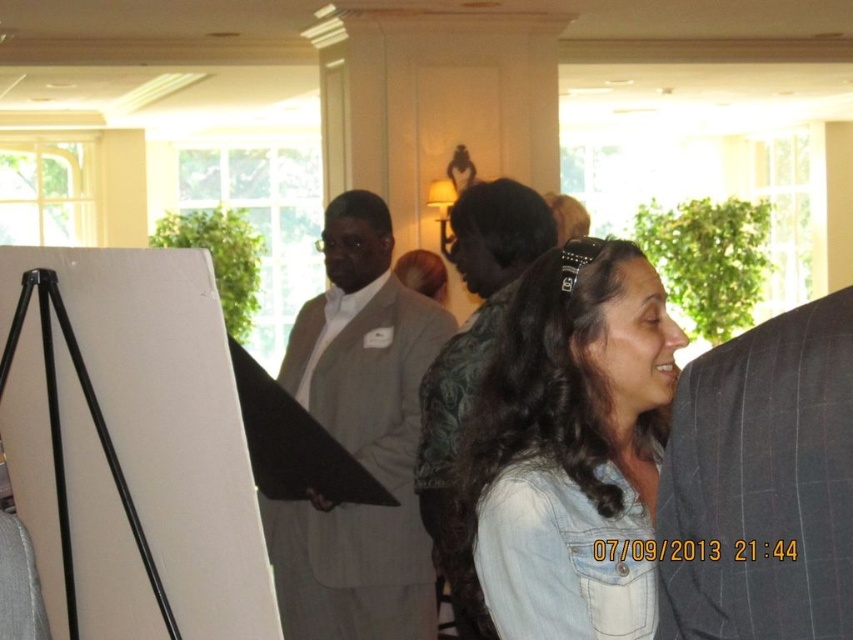
Can you confirm if denim shirt at center is positioned below dark gray suit at center?

Yes.

Does point (614, 605) lie in front of point (456, 342)?

Yes, point (614, 605) is in front of point (456, 342).

I want to click on denim shirt at center, so click(572, 445).

Can you confirm if black matte easel at left is shorter than dark gray pinstripe suit at right?

No.

What do you see at coordinates (167, 422) in the screenshot? The image size is (853, 640). I see `black matte easel at left` at bounding box center [167, 422].

I want to click on black matte easel at left, so click(167, 422).

Can you confirm if denim shirt at center is wider than dark gray pinstripe suit at right?

Yes, denim shirt at center is wider than dark gray pinstripe suit at right.

Is denim shirt at center smaller than dark gray pinstripe suit at right?

No.

Is point (589, 243) positioned in front of point (730, 458)?

No, (589, 243) is further to viewer.

The image size is (853, 640). What are the coordinates of `denim shirt at center` in the screenshot? It's located at (572, 445).